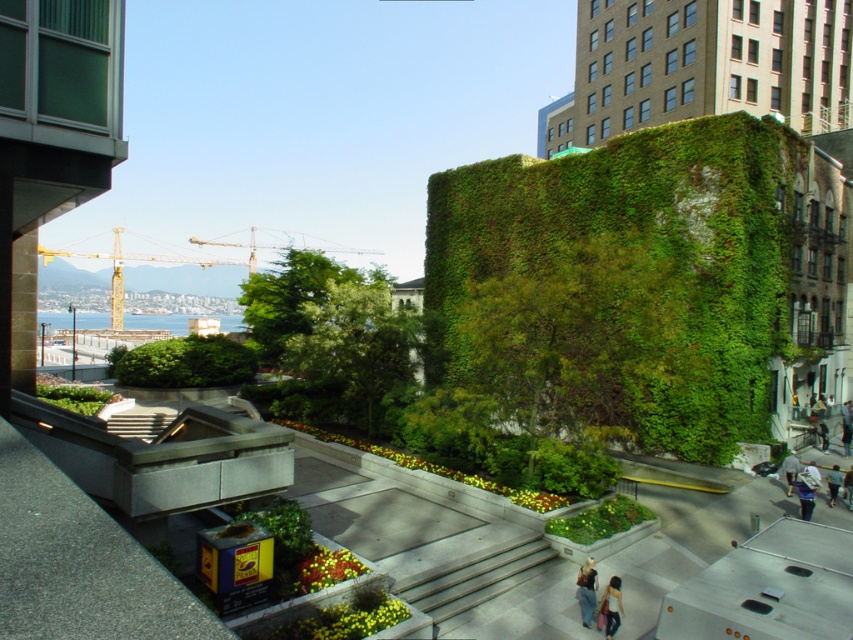
You are a construction worker standing at the base of the yellow metal crane at upper left. You need to move to the nearest building entrance that is 100 meters away. Can you reach it without exceeding the 100 meter limit?

The distance between the yellow metal crane at upper left and the camera is 94.35 meters. Since the nearest building entrance is 100 meters away, you can reach it without exceeding the 100 meter limit.

You are a pedestrian standing on the paved area near the staircase. You see the yellow metal crane at upper left and the dark gray pants at lower right. Which object is positioned higher in the image?

The yellow metal crane at upper left is positioned higher than the dark gray pants at lower right in the image.

You are a photographer trying to capture a candid shot of the light beige fabric bag at lower right and the light blue jeans at lower right. Since you want to ensure both are in focus, you need to know which object is wider. Which one is wider?

The light beige fabric bag at lower right is wider than the light blue jeans at lower right.